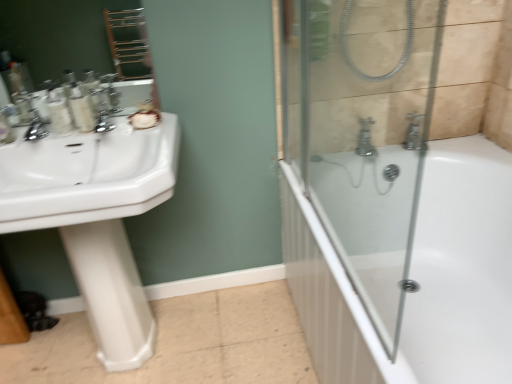
Find the location of a particular element. This screenshot has width=512, height=384. white glossy pedestal at left is located at coordinates (111, 292).

Locate an element on the screen. This screenshot has height=384, width=512. matte plastic bottles at left, the second toiletry positioned from the left is located at coordinates coord(81,108).

The height and width of the screenshot is (384, 512). What do you see at coordinates (59, 112) in the screenshot?
I see `matte plastic bottles at left, the 2th toiletry positioned from the right` at bounding box center [59, 112].

Where is `white glossy sink at left`? Image resolution: width=512 pixels, height=384 pixels. white glossy sink at left is located at coordinates (87, 176).

Locate an element on the screen. The image size is (512, 384). counter top that is above the white glossy bathtub at center (from a real-world perspective) is located at coordinates (87, 176).

Could you tell me if white glossy bathtub at center is turned towards white glossy sink at left?

Yes, white glossy bathtub at center is aimed at white glossy sink at left.

From a real-world perspective, is white glossy bathtub at center positioned above or below white glossy sink at left?

From a real-world perspective, white glossy bathtub at center is physically below white glossy sink at left.

Between white glossy bathtub at center and white glossy sink at left, which one appears on the right side from the viewer's perspective?

Positioned to the right is white glossy bathtub at center.

This screenshot has height=384, width=512. Identify the location of toiletry lying above the matte plastic bottles at left, which appears as the first toiletry when viewed from the left (from the image's perspective). coord(81,108).

From the image's perspective, which one is positioned lower, matte plastic bottles at left, which appears as the first toiletry when viewed from the left, or matte plastic bottles at left, acting as the first toiletry starting from the right?

matte plastic bottles at left, which appears as the first toiletry when viewed from the left, from the image's perspective.

Based on their positions, is matte plastic bottles at left, the 2th toiletry positioned from the right, located to the left or right of matte plastic bottles at left, acting as the first toiletry starting from the right?

In the image, matte plastic bottles at left, the 2th toiletry positioned from the right, appears on the left side of matte plastic bottles at left, acting as the first toiletry starting from the right.

Who is more distant, matte plastic bottles at left, which appears as the first toiletry when viewed from the left, or matte plastic bottles at left, acting as the first toiletry starting from the right?

matte plastic bottles at left, acting as the first toiletry starting from the right, is more distant.

From a real-world perspective, is matte plastic bottles at left, the 2th toiletry positioned from the right, under white glossy bathtub at center?

No, from a real-world perspective, matte plastic bottles at left, the 2th toiletry positioned from the right, is not under white glossy bathtub at center.

Looking at the image, does matte plastic bottles at left, the 2th toiletry positioned from the right, seem bigger or smaller compared to white glossy bathtub at center?

Clearly, matte plastic bottles at left, the 2th toiletry positioned from the right, is smaller in size than white glossy bathtub at center.

Is white glossy bathtub at center at the back of matte plastic bottles at left, the 2th toiletry positioned from the right?

No.

Is matte plastic bottles at left, which appears as the first toiletry when viewed from the left, to the right of white glossy bathtub at center from the viewer's perspective?

No, matte plastic bottles at left, which appears as the first toiletry when viewed from the left, is not to the right of white glossy bathtub at center.

Can you confirm if white glossy sink at left is positioned to the left of white glossy pedestal at left?

Indeed, white glossy sink at left is positioned on the left side of white glossy pedestal at left.

Considering the sizes of objects white glossy sink at left and white glossy pedestal at left in the image provided, who is thinner, white glossy sink at left or white glossy pedestal at left?

Thinner between the two is white glossy pedestal at left.

Can you tell me how much white glossy sink at left and matte plastic bottles at left, the second toiletry positioned from the left, differ in facing direction?

The angular difference between white glossy sink at left and matte plastic bottles at left, the second toiletry positioned from the left, is 2.54 degrees.

Is there a large distance between white glossy sink at left and matte plastic bottles at left, the second toiletry positioned from the left?

white glossy sink at left is near matte plastic bottles at left, the second toiletry positioned from the left, not far away.

Considering the positions of points (3, 192) and (79, 128), is point (3, 192) farther from camera compared to point (79, 128)?

That is False.

In the image, there is a matte plastic bottles at left, acting as the first toiletry starting from the right. In order to click on counter top below it (from a real-world perspective) in this screenshot , I will do `click(87, 176)`.

Is matte plastic bottles at left, the second toiletry positioned from the left, bigger or smaller than white glossy bathtub at center?

In the image, matte plastic bottles at left, the second toiletry positioned from the left, appears to be smaller than white glossy bathtub at center.

From the image's perspective, count 2nd toiletrys upward from the white glossy bathtub at center and point to it. Please provide its 2D coordinates.

[(81, 108)]

Is matte plastic bottles at left, the second toiletry positioned from the left, in front of or behind white glossy bathtub at center in the image?

matte plastic bottles at left, the second toiletry positioned from the left, is behind white glossy bathtub at center.

From a real-world perspective, is matte plastic bottles at left, acting as the first toiletry starting from the right, physically located above or below white glossy bathtub at center?

In terms of real-world spatial position, matte plastic bottles at left, acting as the first toiletry starting from the right, is above white glossy bathtub at center.

Considering the points (65, 122) and (133, 283), which point is in front, point (65, 122) or point (133, 283)?

The point (65, 122) is in front.

Is matte plastic bottles at left, the 2th toiletry positioned from the right, wider or thinner than white glossy pedestal at left?

Considering their sizes, matte plastic bottles at left, the 2th toiletry positioned from the right, looks slimmer than white glossy pedestal at left.

From the image's perspective, is matte plastic bottles at left, the 2th toiletry positioned from the right, under white glossy pedestal at left?

Actually, matte plastic bottles at left, the 2th toiletry positioned from the right, appears above white glossy pedestal at left in the image.

Find the location of a particular element. The height and width of the screenshot is (384, 512). counter top lying above the white glossy bathtub at center (from the image's perspective) is located at coordinates pyautogui.click(x=87, y=176).

Find the location of `toiletry in front of the matte plastic bottles at left, acting as the first toiletry starting from the right`. toiletry in front of the matte plastic bottles at left, acting as the first toiletry starting from the right is located at coordinates (59, 112).

Considering their positions, is white glossy sink at left positioned closer to matte plastic bottles at left, the second toiletry positioned from the left, than white glossy bathtub at center?

The object closer to matte plastic bottles at left, the second toiletry positioned from the left, is white glossy sink at left.

Consider the image. Which object lies nearer to the anchor point white glossy bathtub at center, white glossy sink at left or white glossy pedestal at left?

Based on the image, white glossy pedestal at left appears to be nearer to white glossy bathtub at center.

Estimate the real-world distances between objects in this image. Which object is closer to white glossy pedestal at left, white glossy sink at left or matte plastic bottles at left, acting as the first toiletry starting from the right?

white glossy sink at left lies closer to white glossy pedestal at left than the other object.

When comparing their distances from white glossy bathtub at center, does matte plastic bottles at left, the 2th toiletry positioned from the right, or white glossy sink at left seem further?

matte plastic bottles at left, the 2th toiletry positioned from the right, lies further to white glossy bathtub at center than the other object.

Which object lies nearer to the anchor point matte plastic bottles at left, acting as the first toiletry starting from the right, white glossy sink at left or white glossy pedestal at left?

Among the two, white glossy sink at left is located nearer to matte plastic bottles at left, acting as the first toiletry starting from the right.

Which object lies nearer to the anchor point white glossy bathtub at center, white glossy pedestal at left or matte plastic bottles at left, which appears as the first toiletry when viewed from the left?

white glossy pedestal at left is closer to white glossy bathtub at center.

In the scene shown: From the image, which object appears to be farther from white glossy sink at left, matte plastic bottles at left, the 2th toiletry positioned from the right, or matte plastic bottles at left, acting as the first toiletry starting from the right?

matte plastic bottles at left, the 2th toiletry positioned from the right, is further to white glossy sink at left.

Looking at the image, which one is located further to white glossy sink at left, matte plastic bottles at left, acting as the first toiletry starting from the right, or white glossy bathtub at center?

white glossy bathtub at center.

This screenshot has width=512, height=384. I want to click on bidet between white glossy sink at left and white glossy bathtub at center from left to right, so click(x=111, y=292).

Locate an element on the screen. The image size is (512, 384). toiletry positioned between white glossy sink at left and matte plastic bottles at left, acting as the first toiletry starting from the right, from near to far is located at coordinates (59, 112).

Locate an element on the screen. bidet situated between matte plastic bottles at left, the 2th toiletry positioned from the right, and white glossy bathtub at center from left to right is located at coordinates (111, 292).

Identify the location of bidet located between matte plastic bottles at left, acting as the first toiletry starting from the right, and white glossy bathtub at center in the left-right direction. (111, 292).